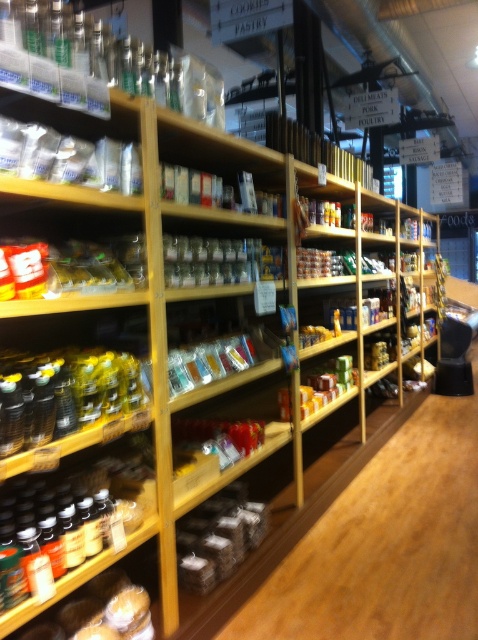
Which is in front, point (118, 275) or point (349, 355)?

Point (118, 275) is more forward.

Between translucent plastic jars at upper left and yellow matte honey jar at center, which one appears on the right side from the viewer's perspective?

Positioned to the right is yellow matte honey jar at center.

Find the location of a particular element. Image resolution: width=478 pixels, height=640 pixels. translucent plastic jars at upper left is located at coordinates (72, 241).

Is brown matte bagels at lower center below translucent plastic spice at center?

Indeed, brown matte bagels at lower center is positioned under translucent plastic spice at center.

How much distance is there between brown matte bagels at lower center and translucent plastic spice at center?

brown matte bagels at lower center is 1.14 meters away from translucent plastic spice at center.

Is point (214, 508) closer to viewer compared to point (262, 253)?

Yes, point (214, 508) is in front of point (262, 253).

This screenshot has height=640, width=478. I want to click on brown matte bagels at lower center, so click(x=218, y=538).

In the scene shown: Is translucent plastic bottles at left wider than golden brown bread at lower left?

No.

Which is more to the right, translucent plastic bottles at left or golden brown bread at lower left?

translucent plastic bottles at left

Identify the location of translucent plastic bottles at left. This screenshot has width=478, height=640. (64, 394).

Locate an element on the screen. This screenshot has height=640, width=478. translucent plastic bottles at left is located at coordinates (64, 394).